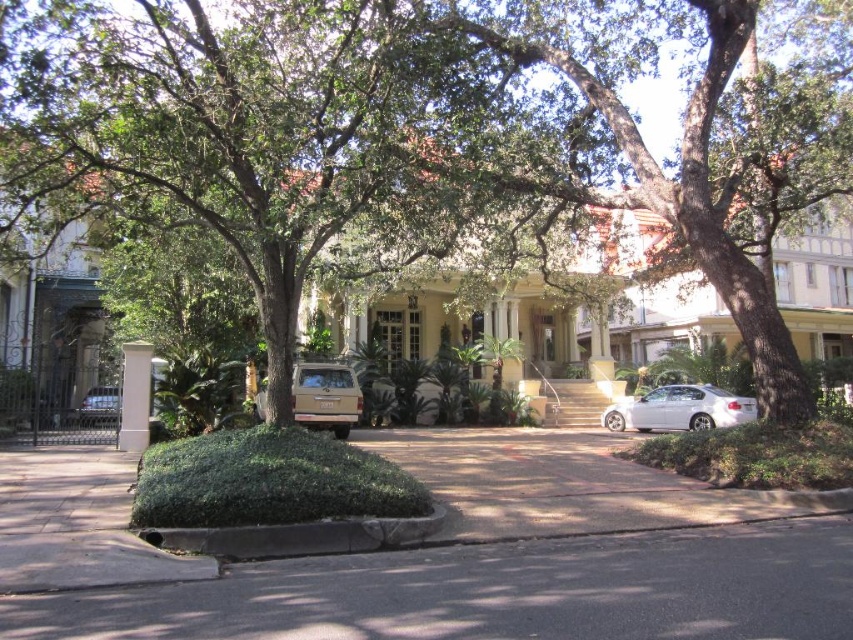
Question: Can you confirm if gray concrete curb at lower center is smaller than white painted wood column at center?

Choices:
 (A) yes
 (B) no

Answer: (A)

Question: Is green leafy tree at center thinner than gray concrete curb at lower center?

Choices:
 (A) no
 (B) yes

Answer: (A)

Question: Does gray concrete curb at lower center have a larger size compared to gold matte suv at center?

Choices:
 (A) no
 (B) yes

Answer: (A)

Question: Which of the following is the closest to the observer?

Choices:
 (A) 347,428
 (B) 665,417
 (C) 552,84
 (D) 550,492

Answer: (D)

Question: Which object is closer to the camera taking this photo?

Choices:
 (A) white glossy sedan at center
 (B) dark gray asphalt at center
 (C) metallic gold suv at center
 (D) green leafy tree at center

Answer: (B)

Question: Estimate the real-world distances between objects in this image. Which object is closer to the green leafy tree at center?

Choices:
 (A) white glossy sedan at center
 (B) metallic gold suv at center
 (C) dark gray asphalt at center

Answer: (C)